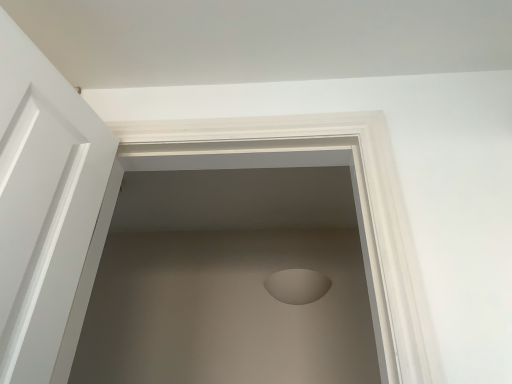
What do you see at coordinates (297, 286) in the screenshot?
I see `white matte light fixture at center` at bounding box center [297, 286].

At what (x,y) coordinates should I click in order to perform the action: click on white matte light fixture at center. Please return your answer as a coordinate pair (x, y). Looking at the image, I should click on (297, 286).

Identify the location of white matte light fixture at center. This screenshot has width=512, height=384. (297, 286).